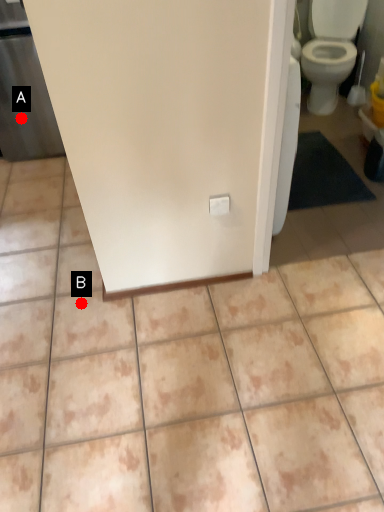
Question: Two points are circled on the image, labeled by A and B beside each circle. Which point is farther from the camera taking this photo?

Choices:
 (A) A is further
 (B) B is further

Answer: (A)